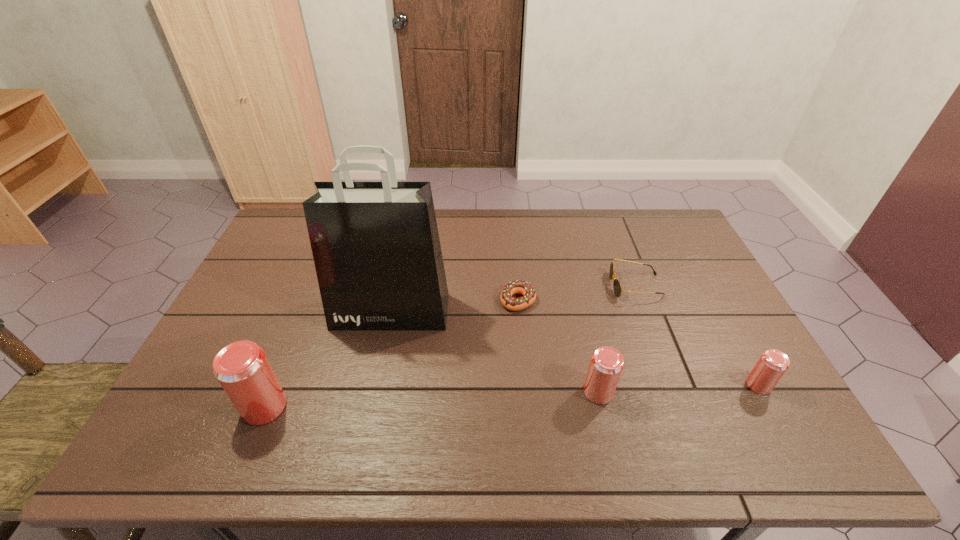
Identify the location of free spot that satisfies the following two spatial constraints: 1. on the front-facing side of the rightmost beer can; 2. on the right side of the fifth object from left to right. (674, 385).

Identify the location of vacant space that satisfies the following two spatial constraints: 1. on the front with handles of the rightmost object; 2. on the left side of the fifth object from right to left. (375, 385).